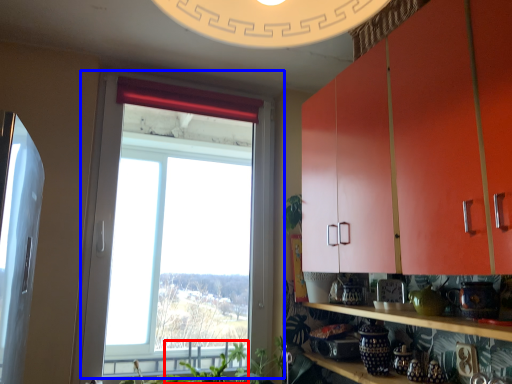
Question: Among these objects, which one is farthest to the camera, plant (highlighted by a red box) or window (highlighted by a blue box)?

Choices:
 (A) plant
 (B) window

Answer: (A)